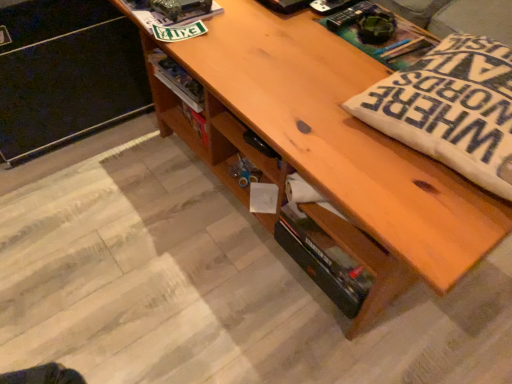
Question: Is white fabric pillow at right located outside wooden file cabinet at lower left?

Choices:
 (A) yes
 (B) no

Answer: (A)

Question: Is white fabric pillow at right bigger than wooden file cabinet at lower left?

Choices:
 (A) yes
 (B) no

Answer: (B)

Question: Is the depth of white fabric pillow at right less than that of wooden file cabinet at lower left?

Choices:
 (A) no
 (B) yes

Answer: (B)

Question: Is white fabric pillow at right in contact with wooden file cabinet at lower left?

Choices:
 (A) no
 (B) yes

Answer: (A)

Question: Considering the relative sizes of white fabric pillow at right and wooden file cabinet at lower left in the image provided, is white fabric pillow at right taller than wooden file cabinet at lower left?

Choices:
 (A) yes
 (B) no

Answer: (B)

Question: From their relative heights in the image, would you say wooden shelf at upper center is taller or shorter than wooden file cabinet at lower left?

Choices:
 (A) short
 (B) tall

Answer: (A)

Question: Is point (143, 51) closer or farther from the camera than point (123, 26)?

Choices:
 (A) farther
 (B) closer

Answer: (A)

Question: From a real-world perspective, is wooden shelf at upper center physically located above or below wooden file cabinet at lower left?

Choices:
 (A) above
 (B) below

Answer: (A)

Question: Considering the positions of wooden shelf at upper center and wooden file cabinet at lower left in the image, is wooden shelf at upper center wider or thinner than wooden file cabinet at lower left?

Choices:
 (A) wide
 (B) thin

Answer: (B)

Question: Would you say white fabric pillow at right is inside or outside wooden file cabinet at lower left?

Choices:
 (A) inside
 (B) outside

Answer: (B)

Question: Is point (471, 96) closer or farther from the camera than point (58, 140)?

Choices:
 (A) closer
 (B) farther

Answer: (A)

Question: In terms of height, does white fabric pillow at right look taller or shorter compared to wooden file cabinet at lower left?

Choices:
 (A) short
 (B) tall

Answer: (A)

Question: From a real-world perspective, relative to wooden file cabinet at lower left, is white fabric pillow at right vertically above or below?

Choices:
 (A) below
 (B) above

Answer: (B)

Question: From the image's perspective, is wooden file cabinet at lower left above or below wooden shelf at upper center?

Choices:
 (A) below
 (B) above

Answer: (B)

Question: Considering the relative positions of wooden file cabinet at lower left and wooden shelf at upper center in the image provided, is wooden file cabinet at lower left to the left or to the right of wooden shelf at upper center?

Choices:
 (A) right
 (B) left

Answer: (B)